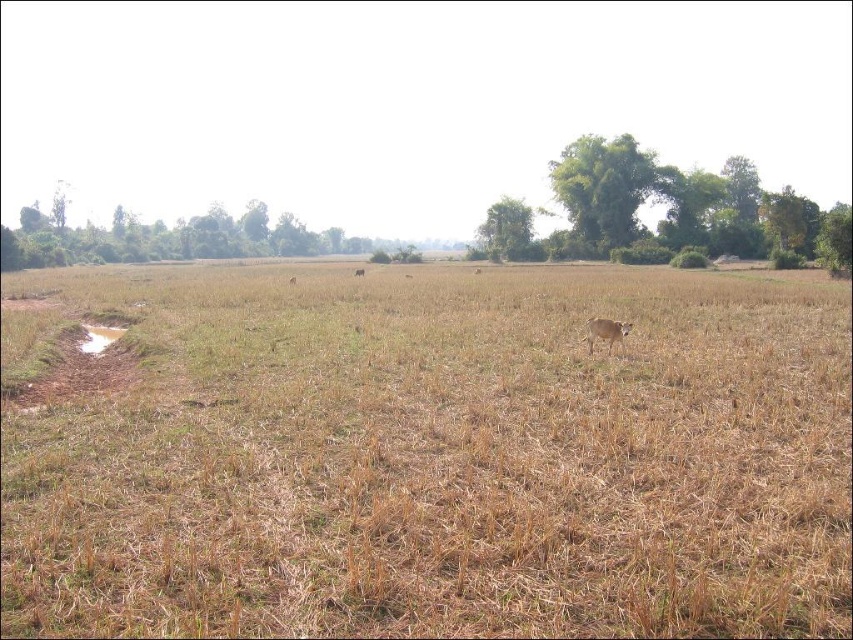
Between brown furry cow at center and brown matte cow at center, which one is positioned higher?

brown matte cow at center is above.

In the scene shown: Who is positioned more to the left, brown furry cow at center or brown matte cow at center?

brown matte cow at center

This screenshot has width=853, height=640. Describe the element at coordinates (605, 332) in the screenshot. I see `brown furry cow at center` at that location.

At what (x,y) coordinates should I click in order to perform the action: click on brown furry cow at center. Please return your answer as a coordinate pair (x, y). Looking at the image, I should click on (605, 332).

Based on the photo, can you confirm if brown dry grass at center is wider than brown matte cow at center?

Yes, brown dry grass at center is wider than brown matte cow at center.

Between point (206, 275) and point (360, 269), which one is positioned behind?

The point (360, 269) is behind.

Where is `brown dry grass at center`? The height and width of the screenshot is (640, 853). brown dry grass at center is located at coordinates (424, 452).

Does point (345, 404) come farther from viewer compared to point (608, 333)?

That is False.

Who is lower down, brown dry grass at center or brown furry cow at center?

brown furry cow at center is lower down.

The width and height of the screenshot is (853, 640). Find the location of `brown dry grass at center`. brown dry grass at center is located at coordinates (424, 452).